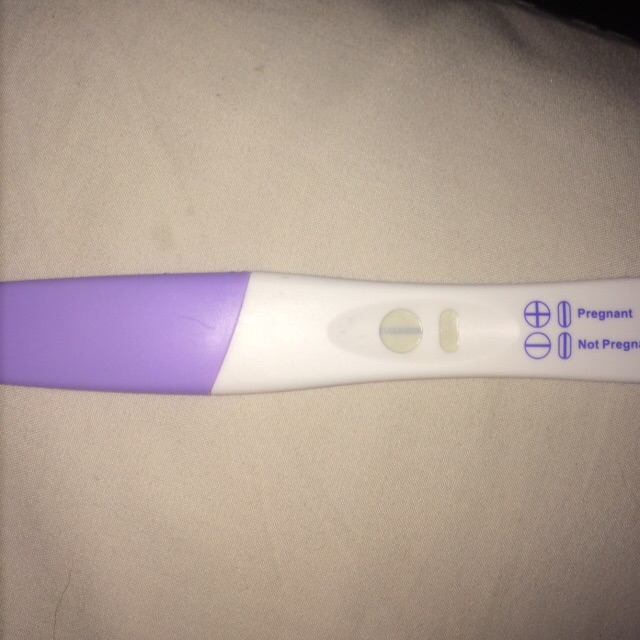
Where is `countertop`? This screenshot has width=640, height=640. countertop is located at coordinates (376, 566).